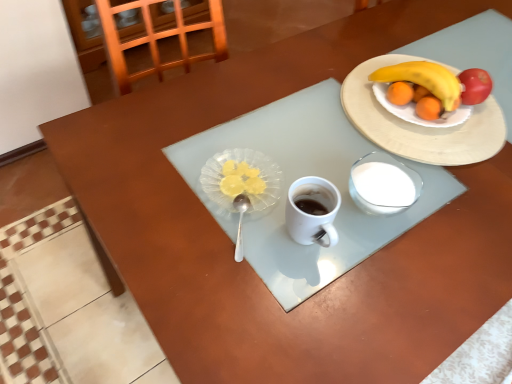
You are a GUI agent. You are given a task and a screenshot of the screen. Output one action in this format:
    pyautogui.click(x=<x>, y=<y>)
    Task: Click on the vacant area in front of silver metallic spoon at center
    The image size is (512, 384).
    Given the screenshot: What is the action you would take?
    pyautogui.click(x=238, y=301)